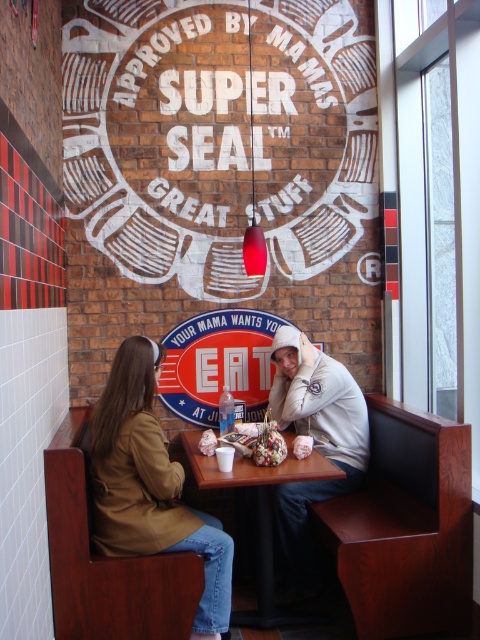
Is brown leather jacket at lower left further to the viewer compared to gray hoodie at center?

That is False.

Which is in front, point (167, 452) or point (319, 435)?

Point (167, 452) is in front.

Between point (156, 451) and point (279, 342), which one is positioned behind?

The point (279, 342) is more distant.

This screenshot has width=480, height=640. I want to click on brown leather jacket at lower left, so [x=151, y=484].

Is gray hoodie at center wider than black plastic table at center?

No.

Can you confirm if gray hoodie at center is bigger than black plastic table at center?

No.

Who is more distant from viewer, (316, 356) or (290, 472)?

The point (316, 356) is more distant.

Identify the location of gray hoodie at center. (314, 440).

Which is in front, point (132, 340) or point (265, 536)?

Positioned in front is point (132, 340).

Does brown leather jacket at lower left appear over black plastic table at center?

Correct, brown leather jacket at lower left is located above black plastic table at center.

Is point (113, 509) positioned in front of point (264, 500)?

Yes, point (113, 509) is closer to viewer.

Where is `brown leather jacket at lower left`? This screenshot has width=480, height=640. brown leather jacket at lower left is located at coordinates (151, 484).